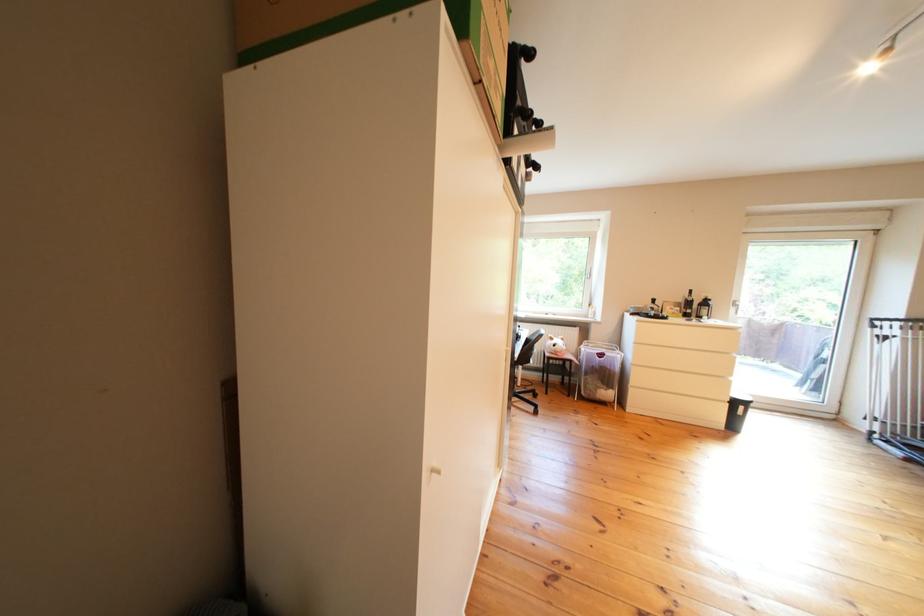
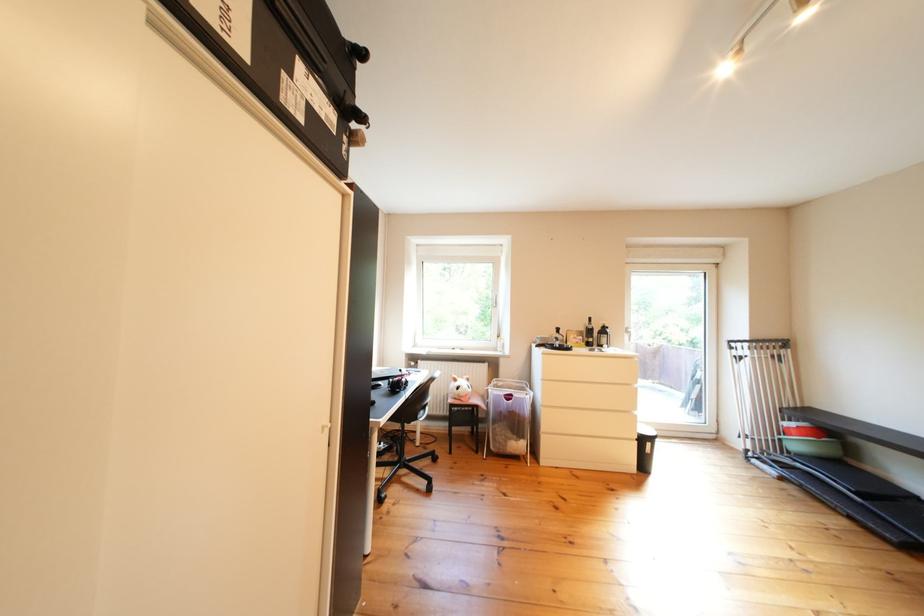
Question: The camera is either moving clockwise (left) or counter-clockwise (right) around the object. The first image is from the beginning of the video and the second image is from the end. Is the camera moving left or right when shooting the video?

Choices:
 (A) Left
 (B) Right

Answer: (A)